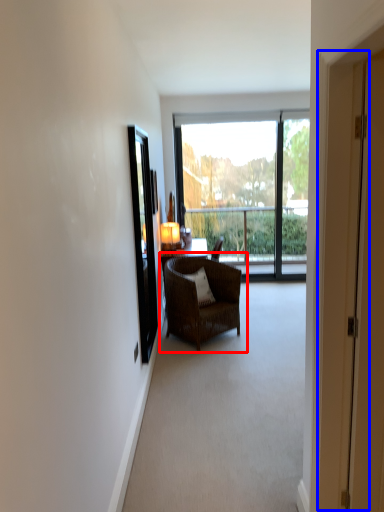
Question: Which object appears farthest to the camera in this image, chair (highlighted by a red box) or screen door (highlighted by a blue box)?

Choices:
 (A) chair
 (B) screen door

Answer: (A)